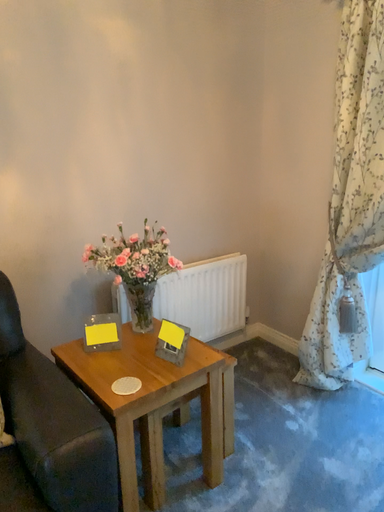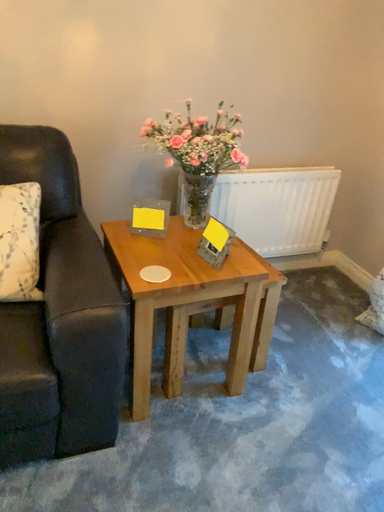
Question: How did the camera likely rotate when shooting the video?

Choices:
 (A) rotated left
 (B) rotated right

Answer: (A)